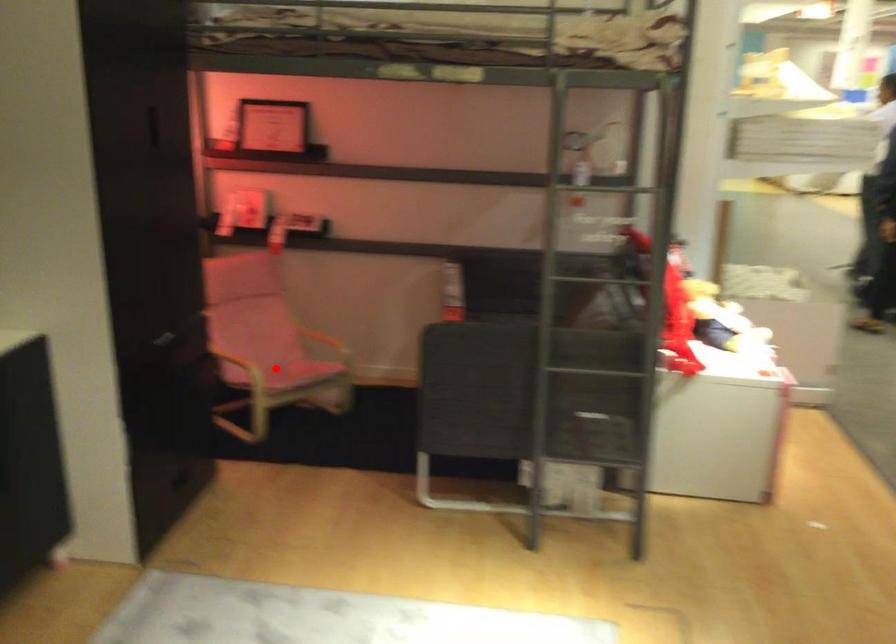
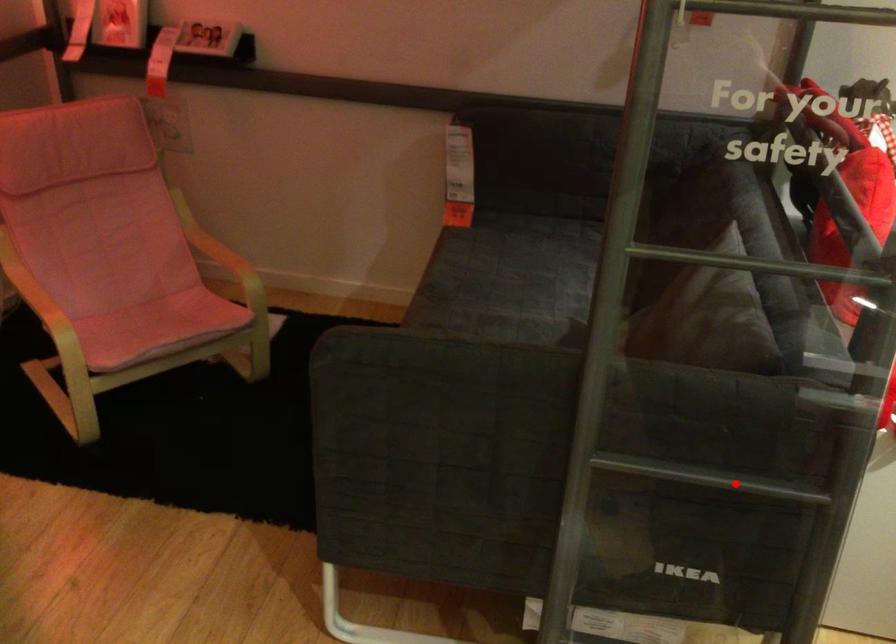
I am providing you with two images of the same scene from different viewpoints. A red point is marked on the first image and another point is marked on the second image. Is the red point in image1 aligned with the point shown in image2?

No